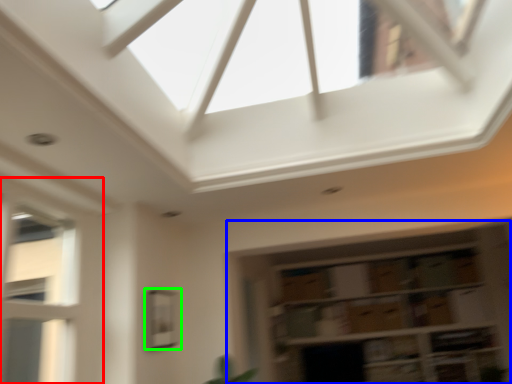
Question: Which is farther away from window (highlighted by a red box)? shelf (highlighted by a blue box) or window (highlighted by a green box)?

Choices:
 (A) shelf
 (B) window

Answer: (A)